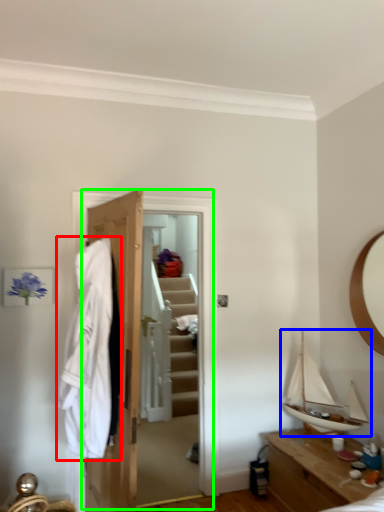
Question: Which object is the closest to the clothing (highlighted by a red box)? Choose among these: boat (highlighted by a blue box) or closet (highlighted by a green box).

Choices:
 (A) boat
 (B) closet

Answer: (B)